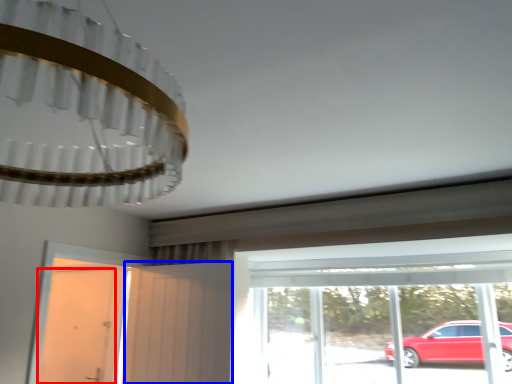
Question: Which object is closer to the camera taking this photo, door (highlighted by a red box) or screen door (highlighted by a blue box)?

Choices:
 (A) door
 (B) screen door

Answer: (B)